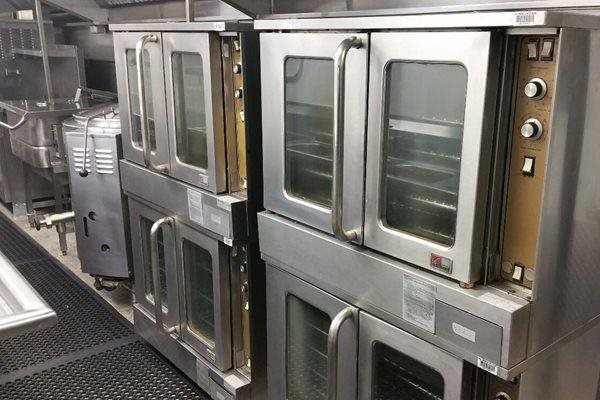
Identify the location of oven door handles. Image resolution: width=600 pixels, height=400 pixels. (333, 332), (338, 115), (142, 98), (153, 242).